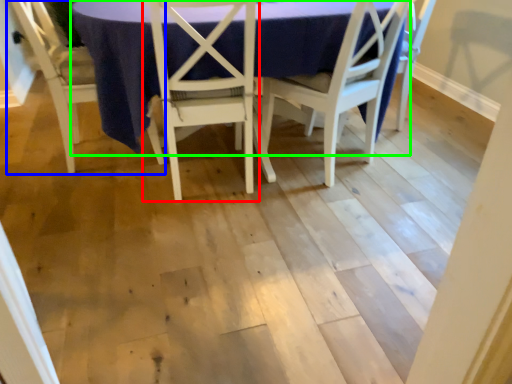
Question: Which object is positioned closest to chair (highlighted by a red box)? Select from chair (highlighted by a blue box) and round table (highlighted by a green box).

Choices:
 (A) chair
 (B) round table

Answer: (B)